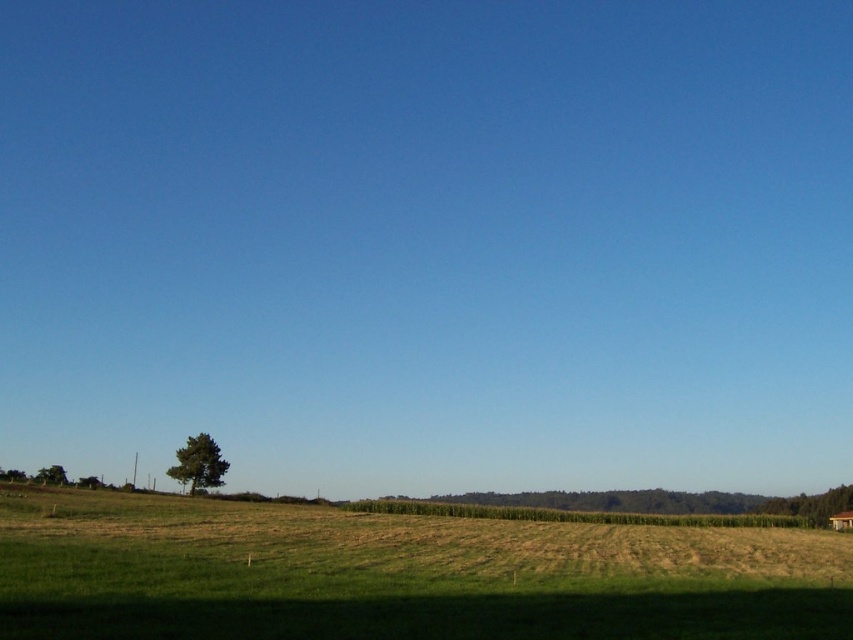
Is green textured tree at lower left shorter than green leafy tree at lower left?

Correct, green textured tree at lower left is not as tall as green leafy tree at lower left.

Between green textured tree at lower left and green leafy tree at lower left, which one has more height?

green leafy tree at lower left

Is point (183, 467) less distant than point (62, 483)?

No.

At what (x,y) coordinates should I click in order to perform the action: click on green textured tree at lower left. Please return your answer as a coordinate pair (x, y). Looking at the image, I should click on (198, 464).

Can you confirm if green grassy field at lower center is thinner than green textured tree at lower left?

No, green grassy field at lower center is not thinner than green textured tree at lower left.

Is green grassy field at lower center taller than green textured tree at lower left?

Yes.

Where is `green grassy field at lower center`? The height and width of the screenshot is (640, 853). green grassy field at lower center is located at coordinates (399, 576).

Based on the photo, is green grassy field at lower center closer to the viewer compared to green leafy tree at lower left?

Yes.

Between green grassy field at lower center and green leafy tree at lower left, which one has less height?

Standing shorter between the two is green grassy field at lower center.

Who is more forward, (840, 589) or (38, 472)?

Positioned in front is point (840, 589).

Where is `green grassy field at lower center`? The width and height of the screenshot is (853, 640). green grassy field at lower center is located at coordinates (399, 576).